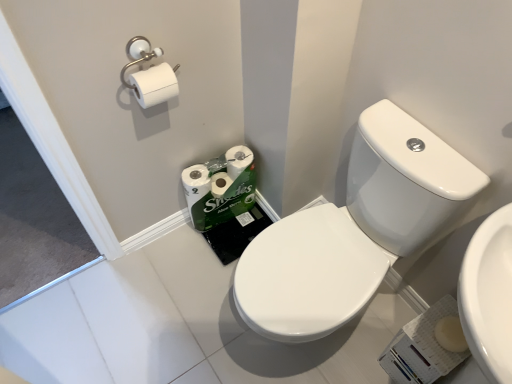
Question: Which direction should I rotate to look at green matte toilet paper at lower center, the 2th toilet paper positioned from the top, — up or down?

Choices:
 (A) down
 (B) up

Answer: (A)

Question: Is there a large distance between green matte toilet paper at lower center, the second toilet paper in the front-to-back sequence, and white glossy sink at center right?

Choices:
 (A) no
 (B) yes

Answer: (A)

Question: Does green matte toilet paper at lower center, the 2th toilet paper positioned from the top, have a smaller size compared to white glossy sink at center right?

Choices:
 (A) yes
 (B) no

Answer: (A)

Question: Can you confirm if green matte toilet paper at lower center, the 2th toilet paper positioned from the top, is shorter than white glossy sink at center right?

Choices:
 (A) no
 (B) yes

Answer: (B)

Question: From a real-world perspective, is green matte toilet paper at lower center, the 2th toilet paper positioned from the top, below white glossy sink at center right?

Choices:
 (A) yes
 (B) no

Answer: (A)

Question: Can you see green matte toilet paper at lower center, which is the 1th toilet paper from bottom to top, touching white glossy sink at center right?

Choices:
 (A) yes
 (B) no

Answer: (B)

Question: Does green matte toilet paper at lower center, the 2th toilet paper positioned from the top, lie behind white glossy sink at center right?

Choices:
 (A) yes
 (B) no

Answer: (A)

Question: Is white matte toilet paper at upper left, the first toilet paper from the top, positioned in front of green matte toilet paper at lower center, which is counted as the first toilet paper, starting from the back?

Choices:
 (A) yes
 (B) no

Answer: (A)

Question: Is white matte toilet paper at upper left, the first toilet paper from the top, facing towards green matte toilet paper at lower center, the 2th toilet paper positioned from the top?

Choices:
 (A) yes
 (B) no

Answer: (B)

Question: Could green matte toilet paper at lower center, which is counted as the first toilet paper, starting from the back, be considered to be inside white matte toilet paper at upper left, positioned as the second toilet paper in back-to-front order?

Choices:
 (A) no
 (B) yes

Answer: (A)

Question: Is white matte toilet paper at upper left, positioned as the second toilet paper in back-to-front order, shorter than green matte toilet paper at lower center, the second toilet paper in the front-to-back sequence?

Choices:
 (A) no
 (B) yes

Answer: (B)

Question: Considering the relative sizes of white matte toilet paper at upper left, the first toilet paper from the top, and green matte toilet paper at lower center, the 2th toilet paper positioned from the top, in the image provided, is white matte toilet paper at upper left, the first toilet paper from the top, thinner than green matte toilet paper at lower center, the 2th toilet paper positioned from the top,?

Choices:
 (A) yes
 (B) no

Answer: (A)

Question: Considering the relative sizes of white matte toilet paper at upper left, the first toilet paper from the top, and green matte toilet paper at lower center, the second toilet paper in the front-to-back sequence, in the image provided, is white matte toilet paper at upper left, the first toilet paper from the top, bigger than green matte toilet paper at lower center, the second toilet paper in the front-to-back sequence,?

Choices:
 (A) no
 (B) yes

Answer: (A)

Question: Are green matte toilet paper at lower center, which is the 1th toilet paper from bottom to top, and white matte toilet paper at upper left, arranged as the 2th toilet paper when ordered from the bottom, beside each other?

Choices:
 (A) no
 (B) yes

Answer: (A)